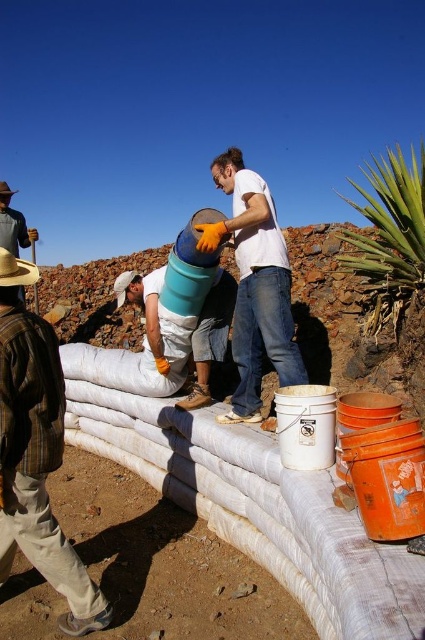
You are a safety inspector observing the construction site in the image. You notice two workers wearing different shirts. The brown plaid shirt at left and the white matte shirt at center. According to safety protocols, workers must be at the same elevation when collaborating. Is there a safety concern here?

The brown plaid shirt at left is located below the white matte shirt at center, indicating they are at different elevations. This violates the safety protocol requiring workers to be at the same elevation when collaborating, so there is a safety concern.

You are standing in the construction area and need to hand a tool to the person wearing the brown plaid shirt at left and the person holding the matte blue bucket at center. Which person should you approach first to ensure you can reach them without moving further into the construction zone?

You should approach the brown plaid shirt at left first because they are closer to you than the matte blue bucket at center, so you can reach them without moving further into the construction zone.

You are a worker in the construction project and you need to hand over a tool to the person wearing the white matte shirt at center. The tool is currently placed on the matte blue bucket at center. In which direction should you move relative to the bucket to reach the person?

The white matte shirt at center is to the right of the matte blue bucket at center, so you should move to the right of the matte blue bucket at center to reach the person.